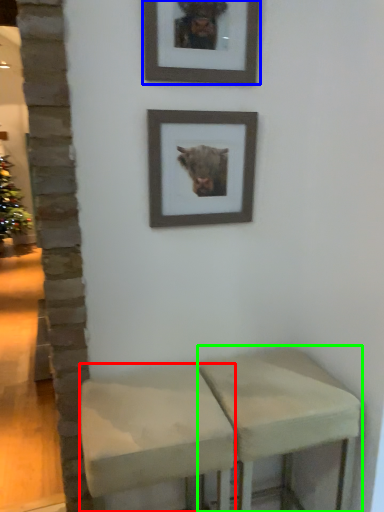
Question: Which object is the farthest from stool (highlighted by a red box)? Choose among these: picture frame (highlighted by a blue box) or stool (highlighted by a green box).

Choices:
 (A) picture frame
 (B) stool

Answer: (A)